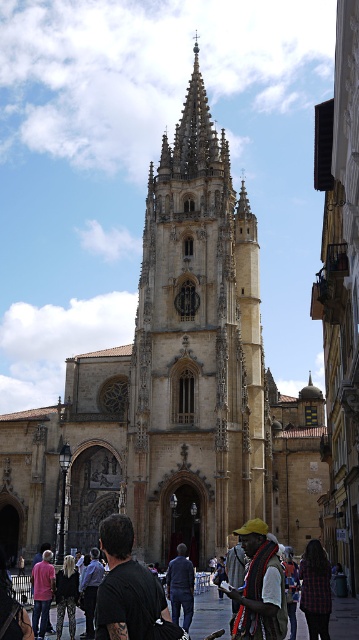
Identify the location of plaid shirt at center. This screenshot has height=640, width=359. (315, 589).

Does plaid shirt at center lie behind camouflage pants at lower center?

No.

Locate an element on the screen. This screenshot has width=359, height=640. plaid shirt at center is located at coordinates (315, 589).

This screenshot has height=640, width=359. I want to click on plaid shirt at center, so click(x=315, y=589).

Does yellow fabric hat at center have a greater height compared to dark blue shirt at center?

Yes, yellow fabric hat at center is taller than dark blue shirt at center.

Who is more distant from viewer, (268, 586) or (91, 630)?

Positioned behind is point (91, 630).

Find the location of a particular element. This screenshot has height=640, width=359. yellow fabric hat at center is located at coordinates (258, 588).

Based on the photo, who is positioned more to the right, golden stone tower at center or plaid shirt at center?

From the viewer's perspective, plaid shirt at center appears more on the right side.

Who is more forward, (156,472) or (313,563)?

Positioned in front is point (313,563).

Identify the location of golden stone tower at center. (194, 349).